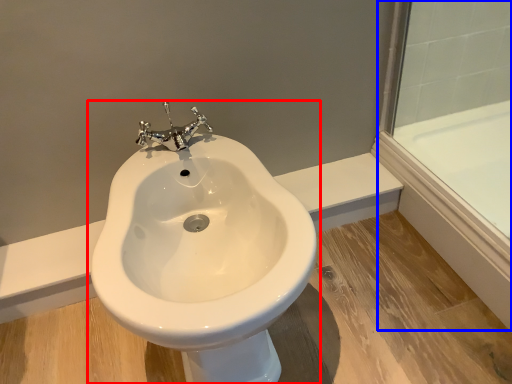
Question: Which of the following is the closest to the observer, toilet (highlighted by a red box) or glass door (highlighted by a blue box)?

Choices:
 (A) toilet
 (B) glass door

Answer: (A)